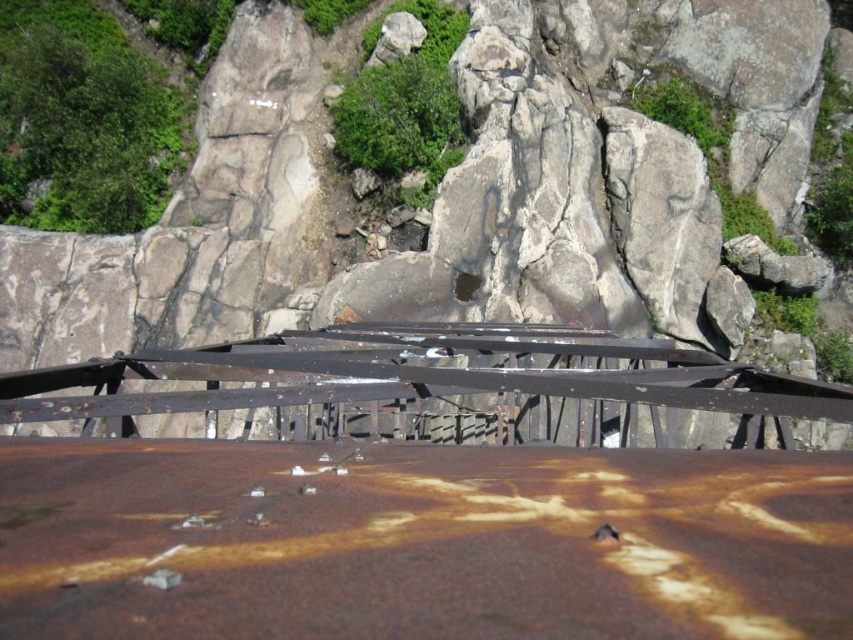
You are a hiker trying to cross the terrain. You notice the rusty metal railing at center and the rusty metal bridge at center. Which structure has a wider width for walking on?

The rusty metal railing at center has a wider width than the rusty metal bridge at center, so it provides a wider path for walking.

You are a drone operator tasked with inspecting the rusty metal surface at center and the rusty metal railing at center. Your drone has a maximum flight distance of 10 meters. Can you reach both objects from your current position without exceeding the drone flight limit?

The rusty metal surface at center is 10.37 meters from the rusty metal railing at center. Since the drone can only fly up to 10 meters, it cannot reach both objects without exceeding the flight limit.